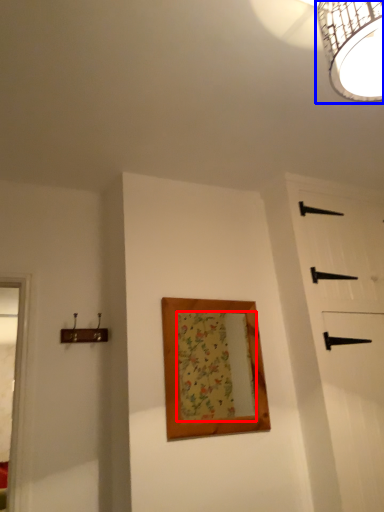
Question: Which of the following is the farthest to the observer, mirror (highlighted by a red box) or lamp (highlighted by a blue box)?

Choices:
 (A) mirror
 (B) lamp

Answer: (A)